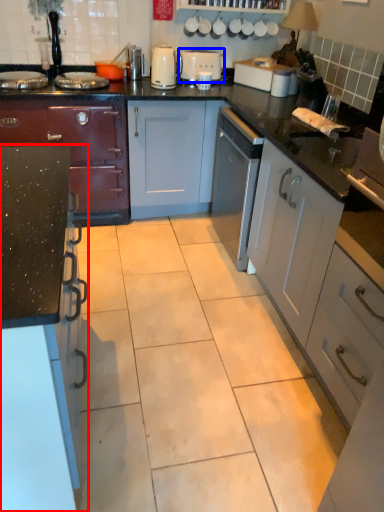
Question: Which object appears closest to the camera in this image, cabinetry (highlighted by a red box) or appliance (highlighted by a blue box)?

Choices:
 (A) cabinetry
 (B) appliance

Answer: (A)